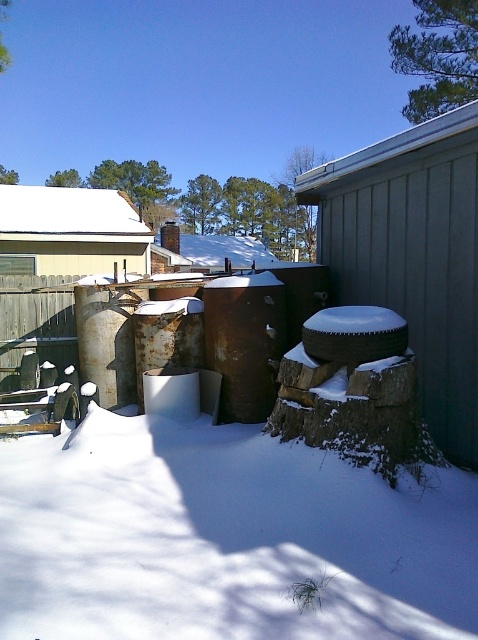
Who is shorter, white powdery snow at lower center or snow-covered tire at right?

Standing shorter between the two is white powdery snow at lower center.

Between white powdery snow at lower center and snow-covered tire at right, which one appears on the right side from the viewer's perspective?

snow-covered tire at right is more to the right.

Is point (61, 481) positioned behind point (477, 404)?

Yes.

Where is `white powdery snow at lower center`? The width and height of the screenshot is (478, 640). white powdery snow at lower center is located at coordinates (225, 538).

Is snow-covered tire at right taller than rusty metal chimney at upper center?

No.

Does snow-covered tire at right appear on the left side of rusty metal chimney at upper center?

No, snow-covered tire at right is not to the left of rusty metal chimney at upper center.

Is point (383, 230) positioned behind point (261, 250)?

No, it is in front of (261, 250).

You are a GUI agent. You are given a task and a screenshot of the screen. Output one action in this format:
    pyautogui.click(x=<x>, y=<y>)
    Task: Click on the snow-covered tire at right
    
    Given the screenshot: What is the action you would take?
    pyautogui.click(x=412, y=256)

Is point (465, 276) behind point (136, 212)?

No.

Who is positioned more to the right, snow-covered tire at right or white matte house at upper left?

Positioned to the right is snow-covered tire at right.

Is point (477, 419) farther from viewer compared to point (65, 188)?

No, (477, 419) is in front of (65, 188).

At what (x,y) coordinates should I click in order to perform the action: click on snow-covered tire at right. Please return your answer as a coordinate pair (x, y). The height and width of the screenshot is (640, 478). Looking at the image, I should click on (412, 256).